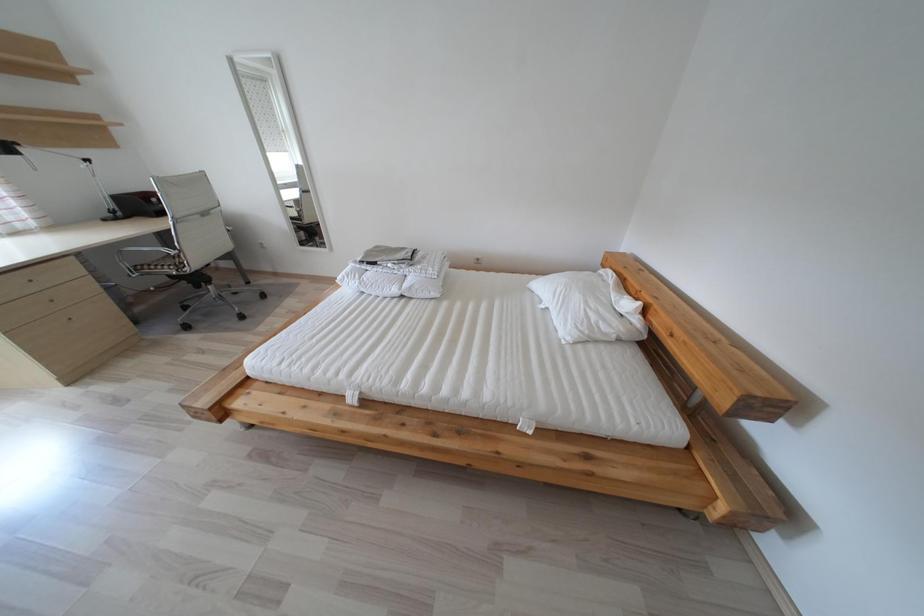
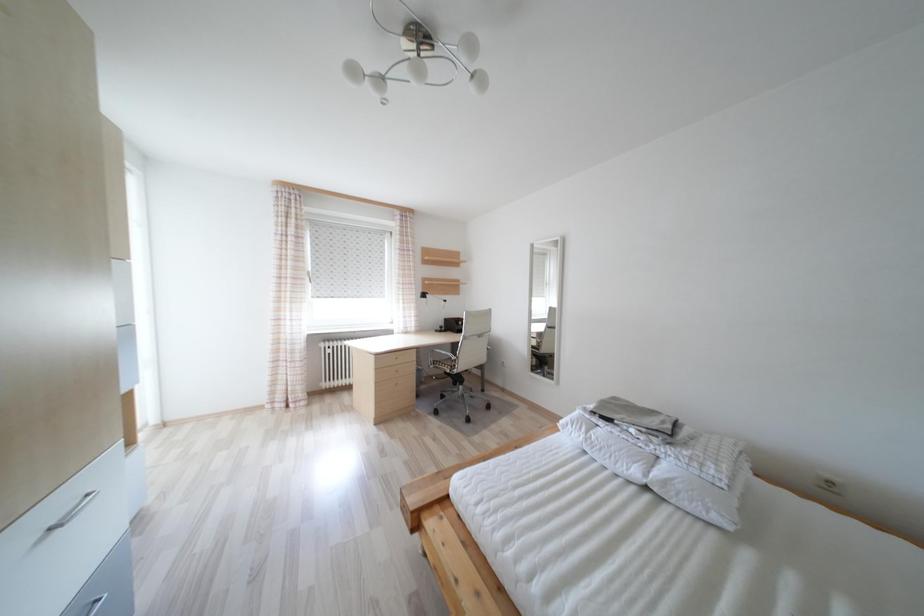
The first image is from the beginning of the video and the second image is from the end. How did the camera likely rotate when shooting the video?

The camera rotated toward left-up.